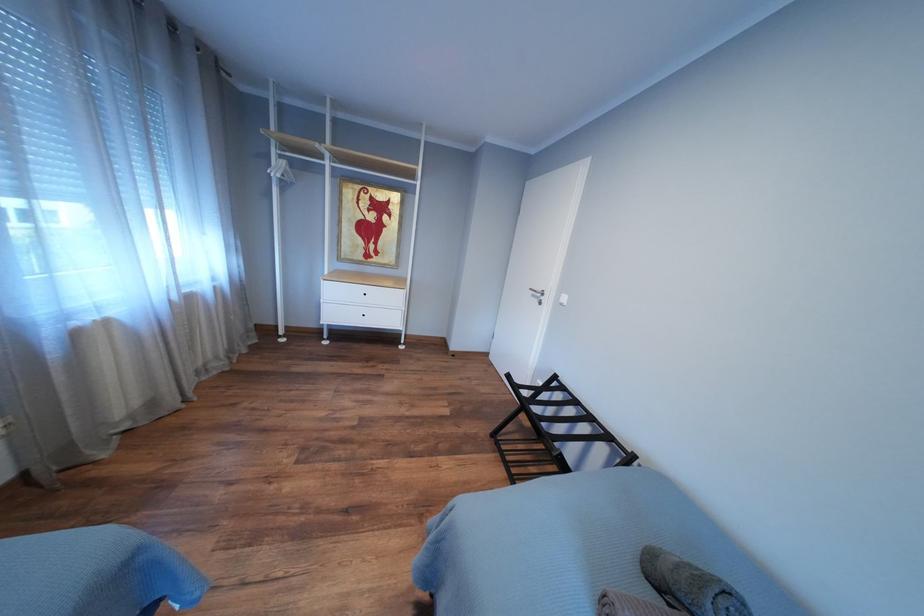
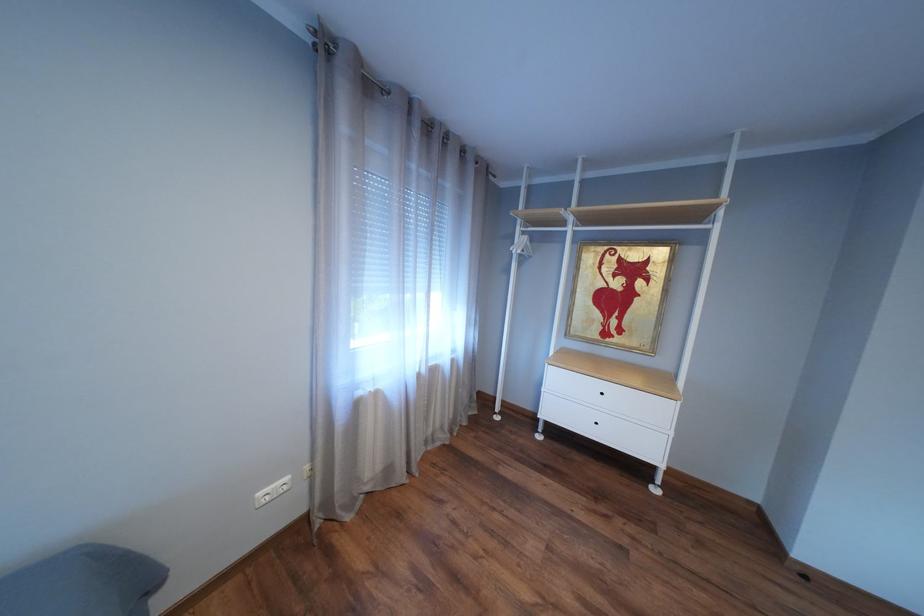
Question: The camera is either moving clockwise (left) or counter-clockwise (right) around the object. The first image is from the beginning of the video and the second image is from the end. Is the camera moving left or right when shooting the video?

Choices:
 (A) Left
 (B) Right

Answer: (B)